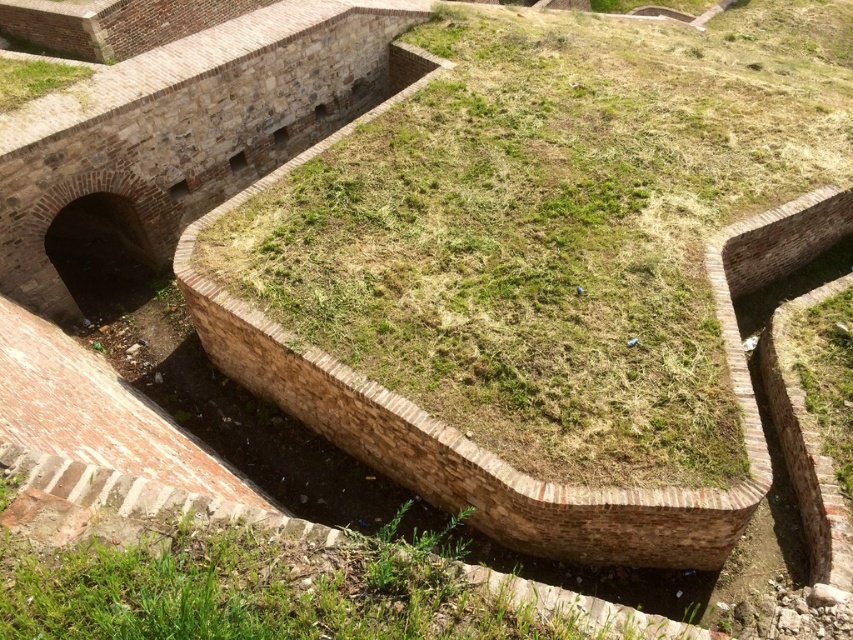
Does green grassy at center appear over green grassy at upper left?

No, green grassy at center is not above green grassy at upper left.

Does green grassy at center appear under green grassy at upper left?

Yes, green grassy at center is below green grassy at upper left.

Between point (717, 364) and point (55, 65), which one is positioned behind?

Point (55, 65)

You are a GUI agent. You are given a task and a screenshot of the screen. Output one action in this format:
    pyautogui.click(x=<x>, y=<y>)
    Task: Click on the green grassy at center
    
    Given the screenshot: What is the action you would take?
    pyautogui.click(x=554, y=228)